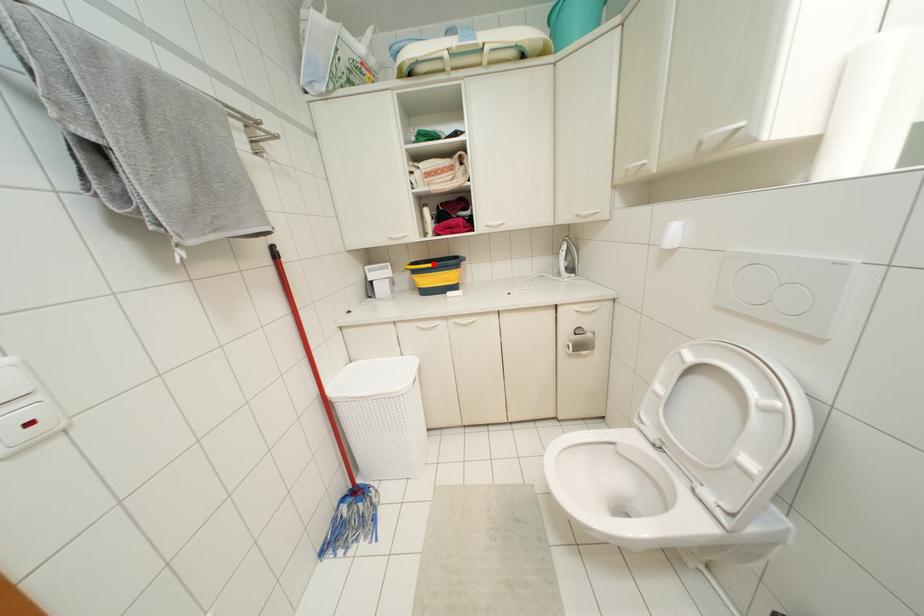
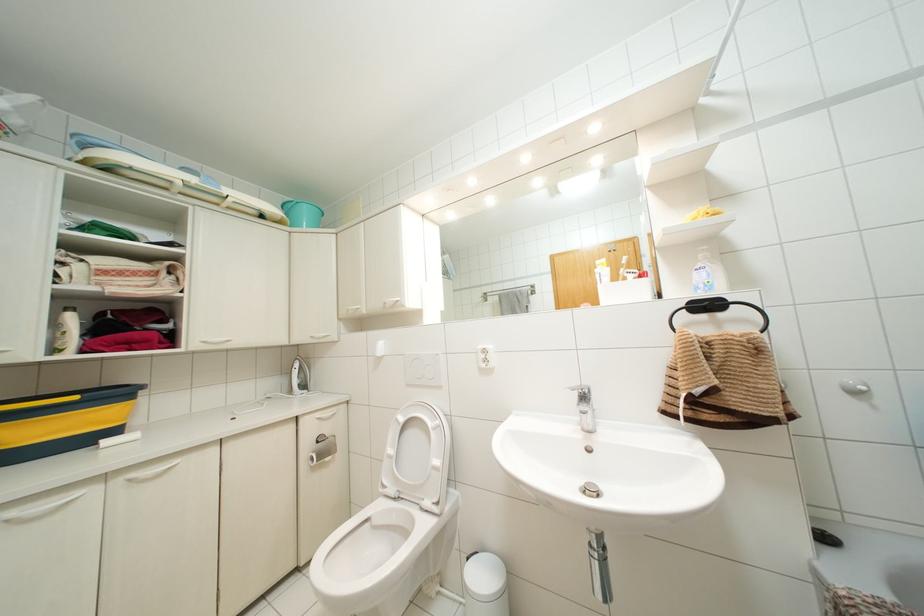
The point at the highlighted location is marked in the first image. Where is the corresponding point in the second image?

(75, 397)